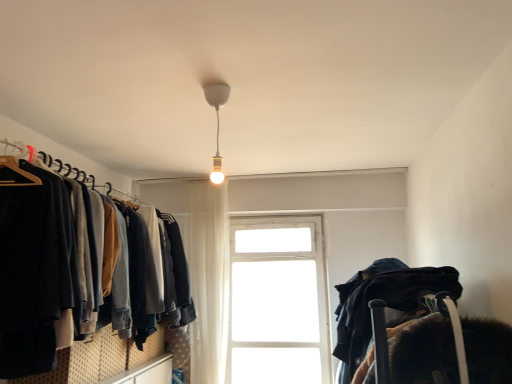
Question: Should I look upward or downward to see white matte bulb at center?

Choices:
 (A) down
 (B) up

Answer: (B)

Question: Considering the relative sizes of white matte bulb at center and white glass window at center in the image provided, is white matte bulb at center taller than white glass window at center?

Choices:
 (A) yes
 (B) no

Answer: (B)

Question: Could white glass window at center be considered to be inside white matte bulb at center?

Choices:
 (A) yes
 (B) no

Answer: (B)

Question: Can you confirm if white matte bulb at center is bigger than white glass window at center?

Choices:
 (A) yes
 (B) no

Answer: (B)

Question: Is white matte bulb at center far from white glass window at center?

Choices:
 (A) yes
 (B) no

Answer: (A)

Question: Can you confirm if white matte bulb at center is wider than white glass window at center?

Choices:
 (A) no
 (B) yes

Answer: (B)

Question: Is the surface of white matte bulb at center in direct contact with white glass window at center?

Choices:
 (A) no
 (B) yes

Answer: (A)

Question: Is white glass window at center completely or partially outside of white matte bulb at center?

Choices:
 (A) no
 (B) yes

Answer: (B)

Question: From the image's perspective, is white glass window at center below white matte bulb at center?

Choices:
 (A) yes
 (B) no

Answer: (A)

Question: From the image's perspective, is white glass window at center located above white matte bulb at center?

Choices:
 (A) yes
 (B) no

Answer: (B)

Question: Is white glass window at center to the left of white matte bulb at center from the viewer's perspective?

Choices:
 (A) yes
 (B) no

Answer: (B)

Question: Can you confirm if white glass window at center is shorter than white matte bulb at center?

Choices:
 (A) no
 (B) yes

Answer: (A)

Question: Would you say white glass window at center is a long distance from white matte bulb at center?

Choices:
 (A) no
 (B) yes

Answer: (B)

Question: Does dark blue sweater at left have a lesser height compared to white sheer curtain at center?

Choices:
 (A) yes
 (B) no

Answer: (A)